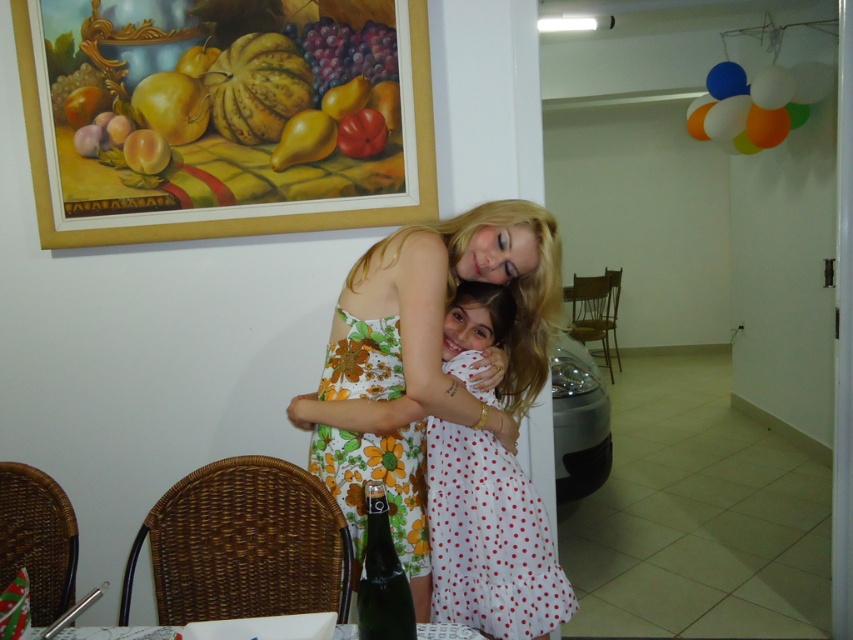
Based on the coordinates provided, where is the floral print fabric dress at center located in the image?

The floral print fabric dress at center is located at the 2D coordinates point (x=376, y=480).

You are standing in the dining area and want to place a small vase between the two points labeled point (x=444, y=556) and point (x=419, y=570). Which point should the vase be closer to in order to be nearer to the viewer?

The vase should be placed closer to point (x=444, y=556) because it is closer to the viewer than point (x=419, y=570).